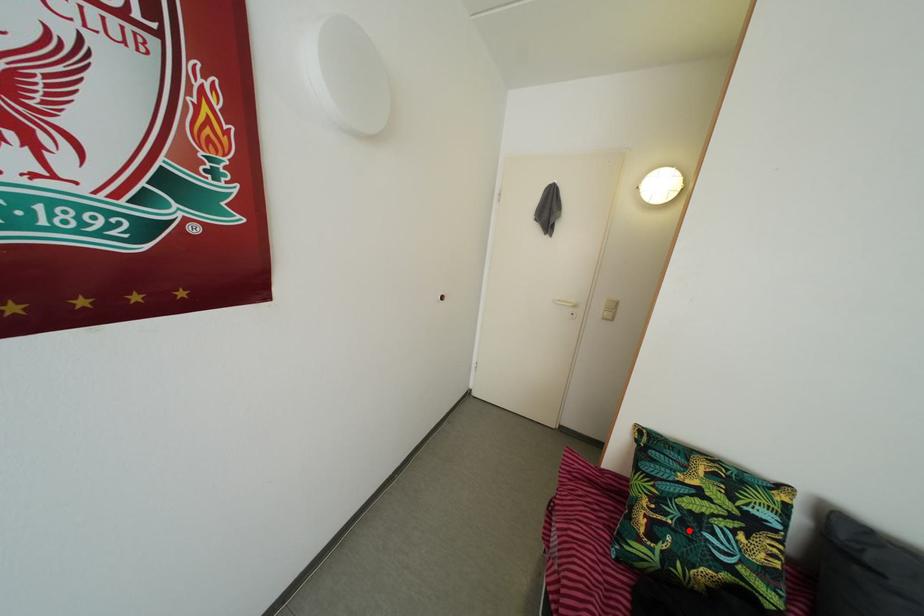
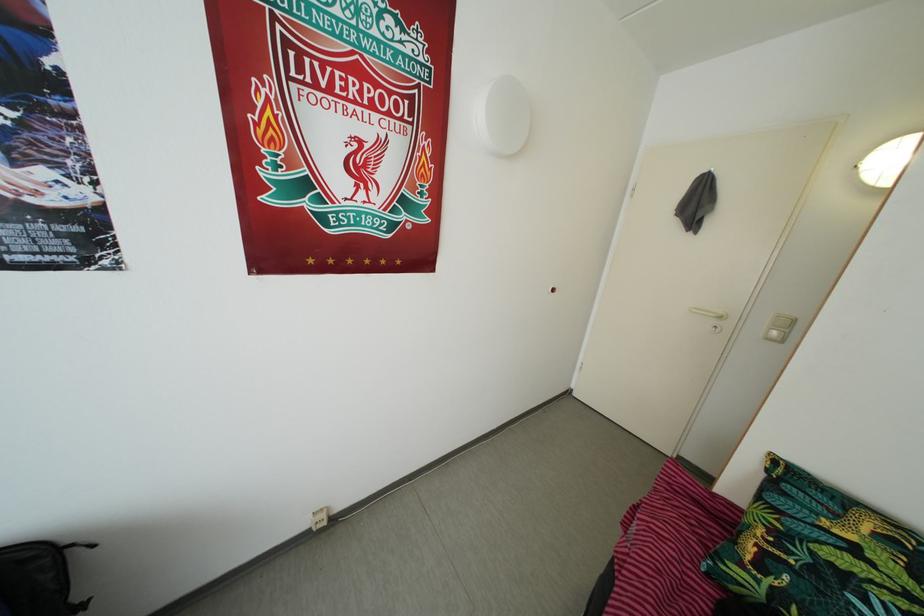
Question: I am providing you with two images of the same scene from different viewpoints. In image1, a red point is highlighted. Considering the same 3D point in image2, which of the following is correct?

Choices:
 (A) It is closer
 (B) It is farther

Answer: (A)